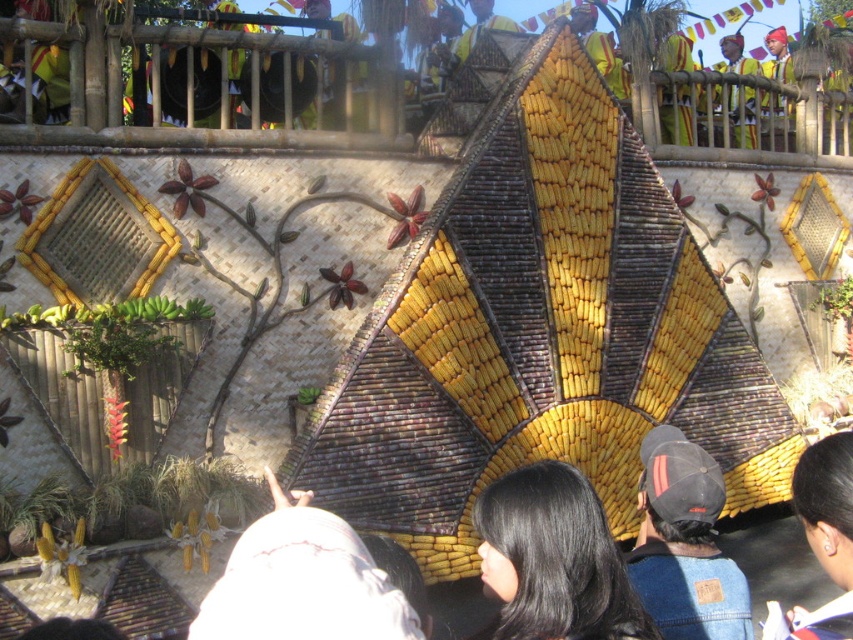
How far apart are white fabric at center and yellow fabric headband at upper right?

white fabric at center is 124.13 feet away from yellow fabric headband at upper right.

Image resolution: width=853 pixels, height=640 pixels. What are the coordinates of `white fabric at center` in the screenshot? It's located at (x=302, y=580).

Identify the location of white fabric at center. The image size is (853, 640). (302, 580).

Is point (791, 493) in front of point (726, 64)?

Yes, point (791, 493) is in front of point (726, 64).

Who is shorter, black hair at lower center or yellow fabric headband at upper right?

With less height is black hair at lower center.

Between point (805, 502) and point (751, 74), which one is positioned behind?

The point (751, 74) is behind.

Where is `black hair at lower center`? black hair at lower center is located at coordinates (827, 502).

Can you confirm if white fabric at center is wider than black hair at lower center?

No, white fabric at center is not wider than black hair at lower center.

Does point (334, 621) come closer to viewer compared to point (821, 500)?

Yes, point (334, 621) is in front of point (821, 500).

Between point (341, 580) and point (816, 442), which one is positioned in front?

Positioned in front is point (341, 580).

Where is `white fabric at center`? The image size is (853, 640). white fabric at center is located at coordinates (302, 580).